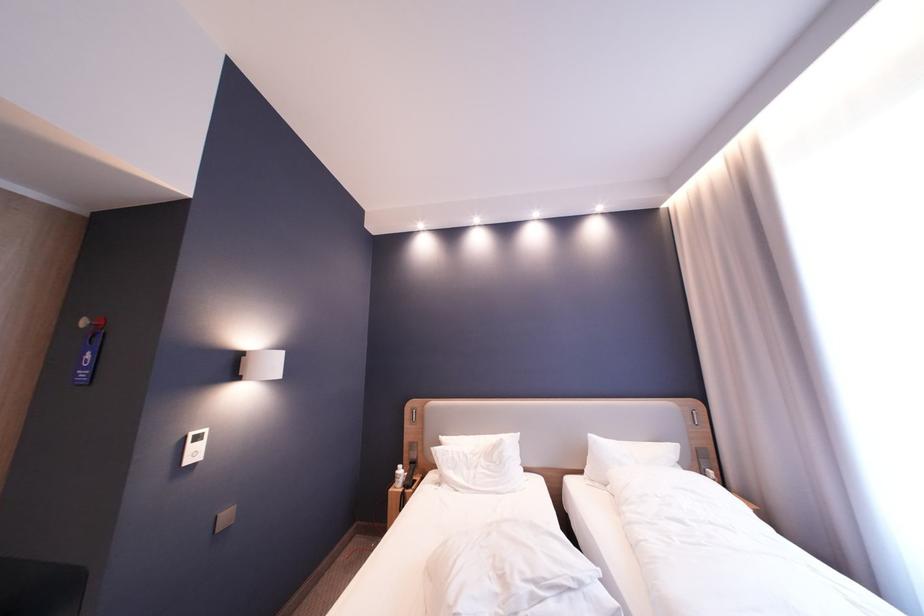
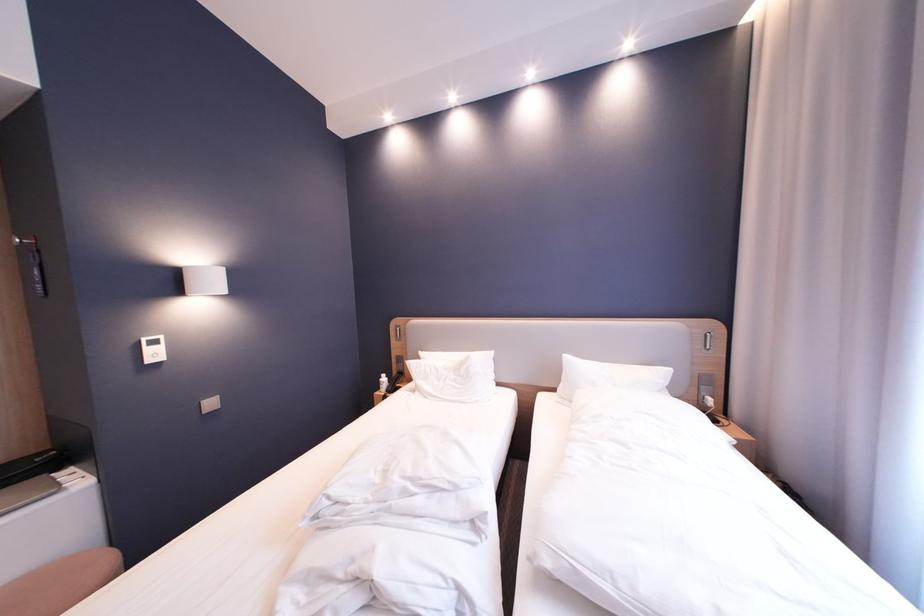
The images are taken continuously from a first-person perspective. In which direction are you moving?

The cameraman walked toward right, forward.